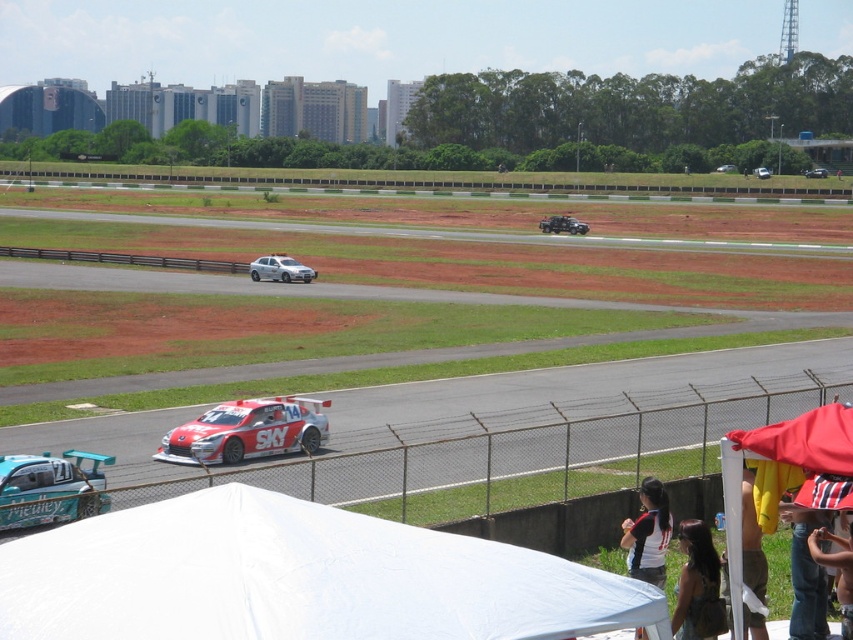
Who is shorter, white fabric canopy at lower center or white glossy race car at center?

white fabric canopy at lower center

Is point (215, 506) less distant than point (318, 435)?

Yes, it is in front of point (318, 435).

Locate an element on the screen. white fabric canopy at lower center is located at coordinates (297, 579).

Who is lower down, white glossy race car at center or shiny metallic race car at center?

white glossy race car at center is lower down.

Which is above, white glossy race car at center or shiny metallic race car at center?

shiny metallic race car at center is higher up.

Locate an element on the screen. This screenshot has width=853, height=640. white glossy race car at center is located at coordinates (247, 432).

Consider the image. Does red fabric canopy at lower right appear on the right side of satin silver sedan at center?

Correct, you'll find red fabric canopy at lower right to the right of satin silver sedan at center.

Consider the image. Can you confirm if red fabric canopy at lower right is positioned below satin silver sedan at center?

Correct, red fabric canopy at lower right is located below satin silver sedan at center.

What are the coordinates of `red fabric canopy at lower right` in the screenshot? It's located at coord(785,474).